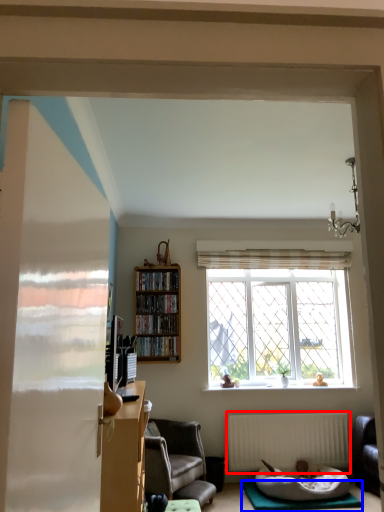
Question: Which object is further to the camera taking this photo, radiator (highlighted by a red box) or yoga mat (highlighted by a blue box)?

Choices:
 (A) radiator
 (B) yoga mat

Answer: (A)